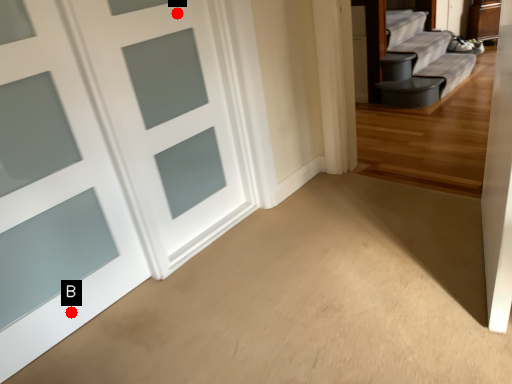
Question: Two points are circled on the image, labeled by A and B beside each circle. Which point is closer to the camera?

Choices:
 (A) A is closer
 (B) B is closer

Answer: (B)